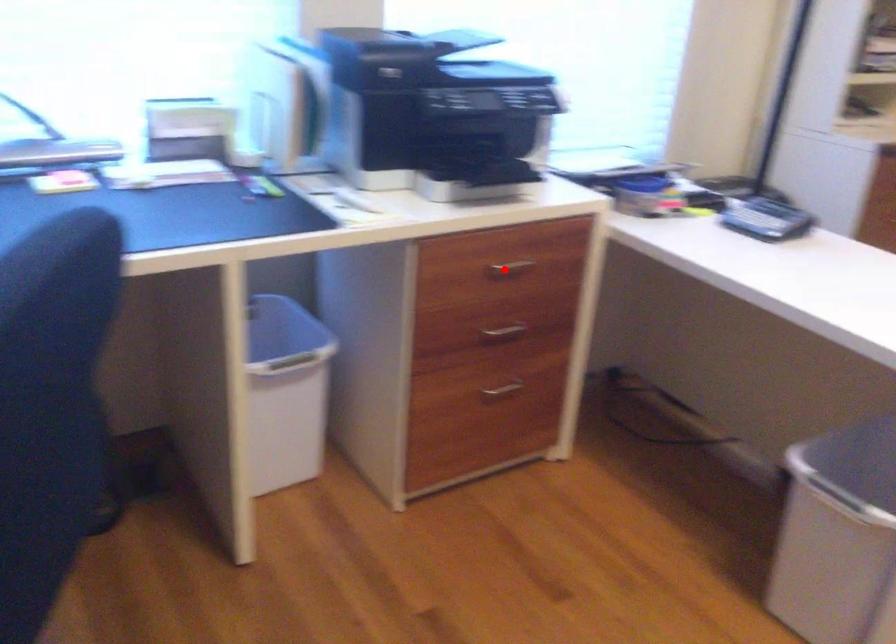
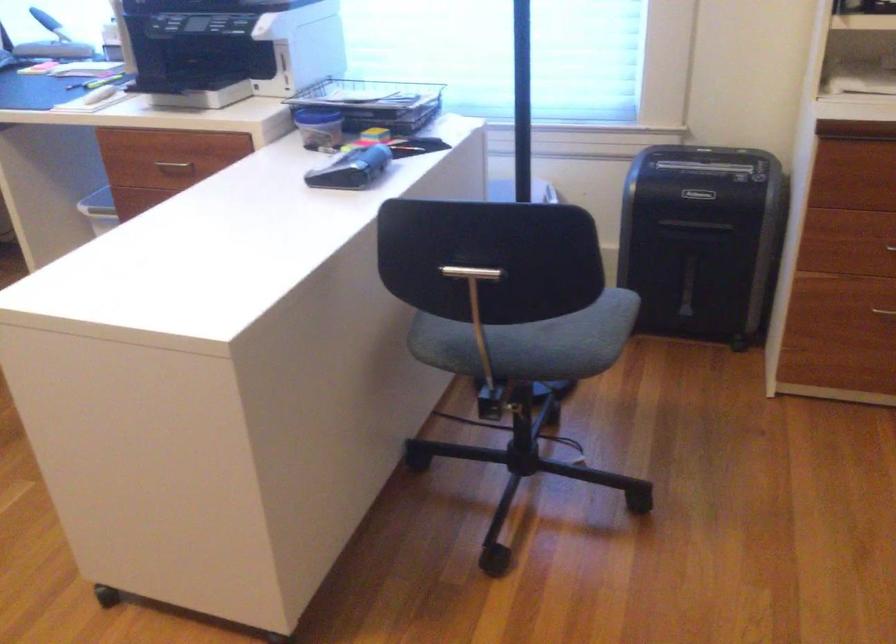
The point at the highlighted location is marked in the first image. Where is the corresponding point in the second image?

(174, 165)